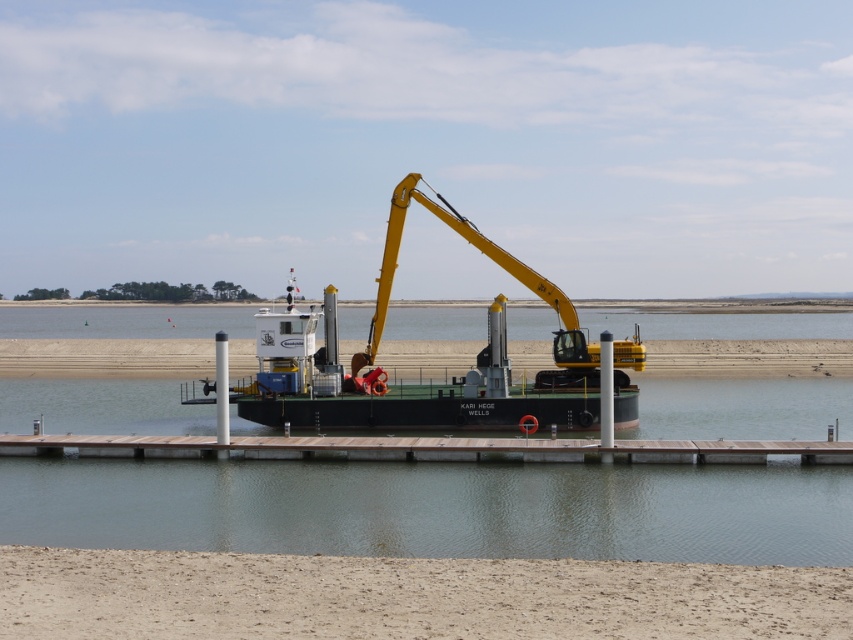
Consider the image. You are standing on the brown wooden dock at center and want to board the green matte barge at center. Which direction should you move to reach the barge?

The green matte barge at center is to the right of the brown wooden dock at center, so you should move to your right to reach the barge.

You are a crane operator on the green matte barge at center. You need to lower a heavy load onto the brown wooden dock at center. Based on the scene, is the dock directly below the barge? Explain your reasoning.

The green matte barge at center is located above the brown wooden dock at center, so yes, the dock is directly below the barge. This means the crane operator can safely lower the load onto the dock without needing to move the barge.

You are a marine biologist conducting a study on the water quality of the lagoon. You need to collect samples from the edge of the green matte barge at center and the brown wooden dock at center. Based on their sizes, which location might be more stable for taking samples?

The brown wooden dock at center is larger than the green matte barge at center, so it might be more stable for collecting samples.